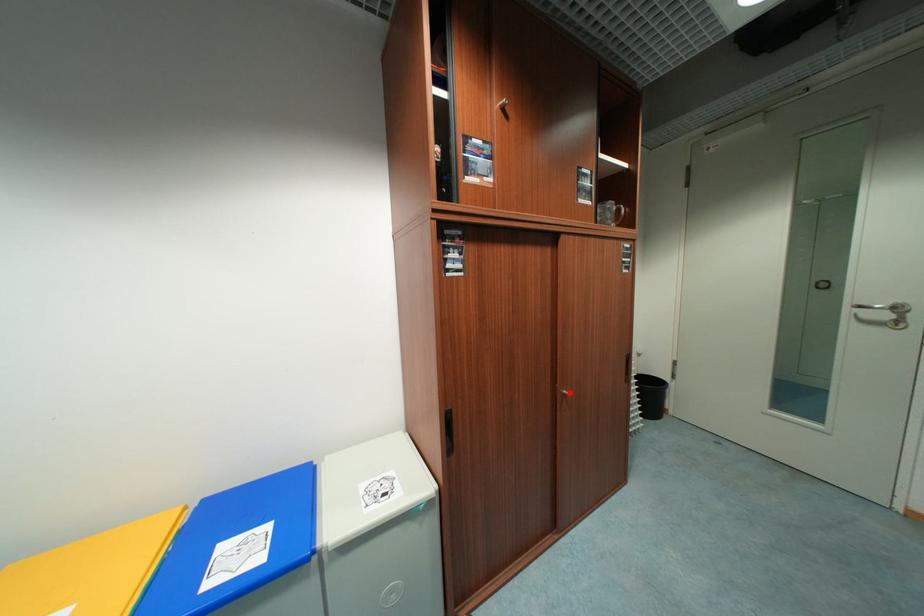
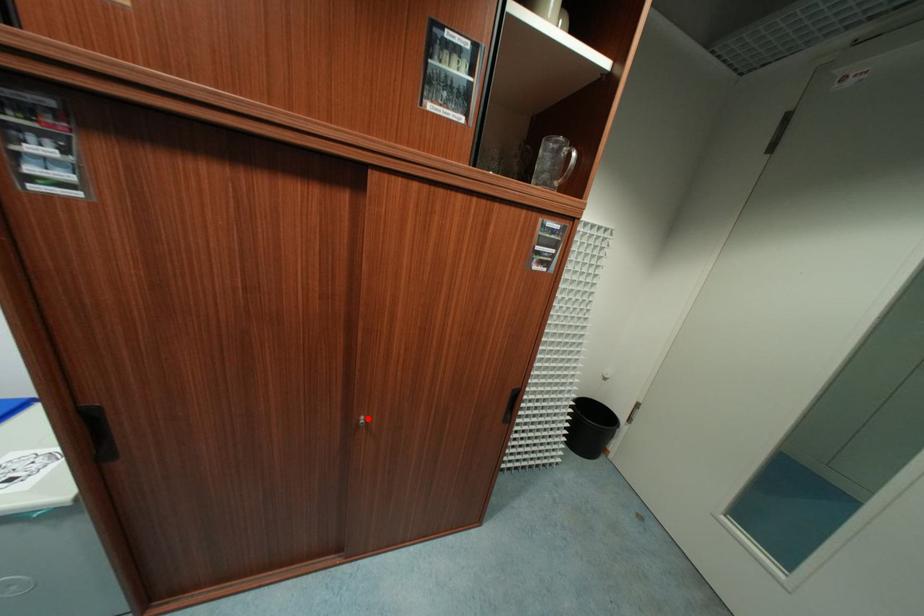
I am providing you with two images of the same scene from different viewpoints. A red point is marked on the first image and another point is marked on the second image. Is the red point in image1 aligned with the point shown in image2?

Yes